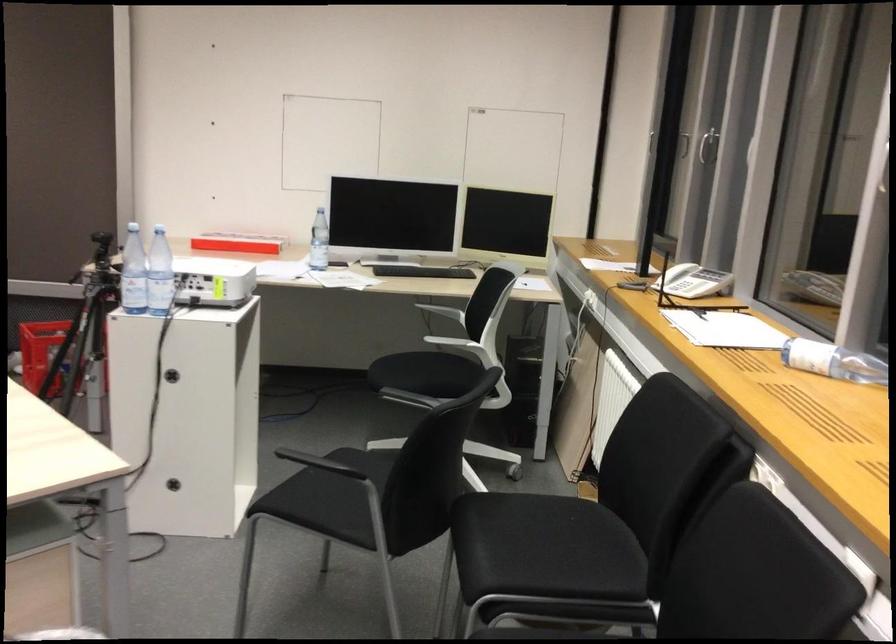
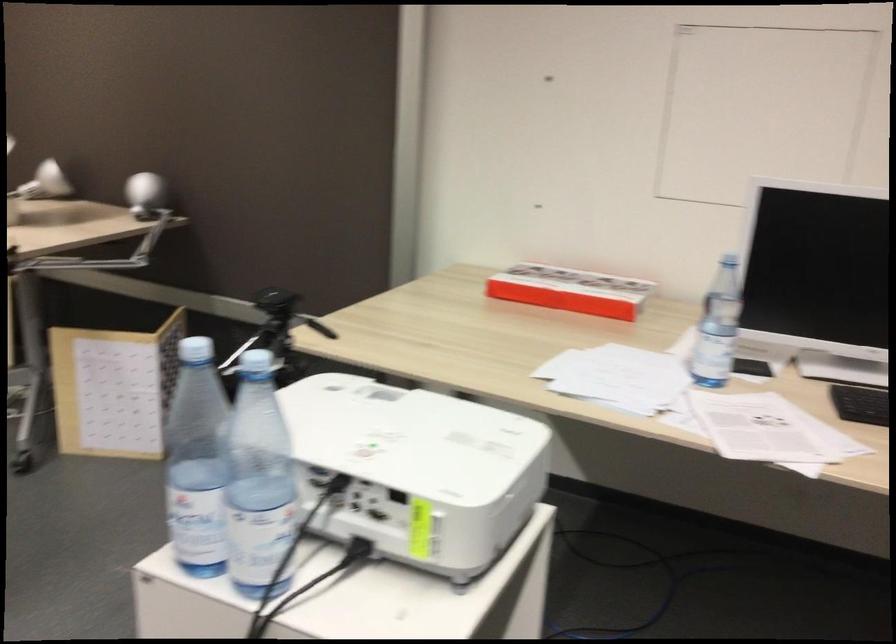
Locate, in the second image, the point that corresponds to pixel 316 243 in the first image.

(718, 327)